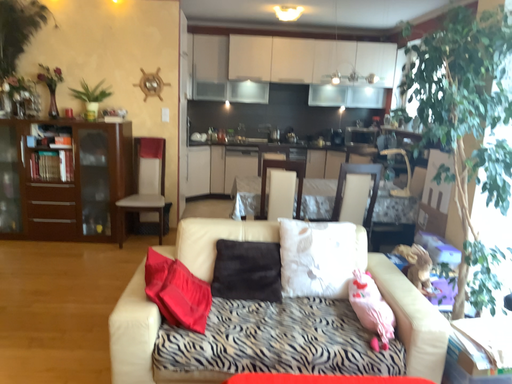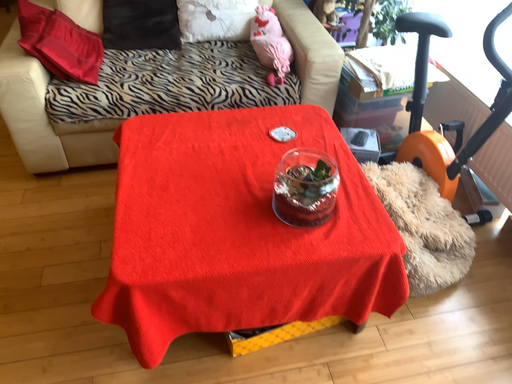
Question: How did the camera likely rotate when shooting the video?

Choices:
 (A) rotated left
 (B) rotated right

Answer: (B)